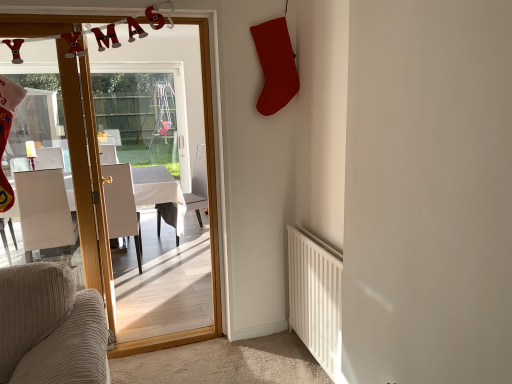
Question: Is white matte radiator at lower right oriented towards white glossy table at center?

Choices:
 (A) yes
 (B) no

Answer: (B)

Question: Is white glossy table at center located within white matte radiator at lower right?

Choices:
 (A) no
 (B) yes

Answer: (A)

Question: Can you confirm if white matte radiator at lower right is bigger than white glossy table at center?

Choices:
 (A) no
 (B) yes

Answer: (A)

Question: From a real-world perspective, is white matte radiator at lower right below white glossy table at center?

Choices:
 (A) no
 (B) yes

Answer: (A)

Question: Is white matte radiator at lower right located outside white glossy table at center?

Choices:
 (A) yes
 (B) no

Answer: (A)

Question: Is white matte radiator at lower right taller than white glossy table at center?

Choices:
 (A) no
 (B) yes

Answer: (B)

Question: Considering the relative positions of white glossy table at center and wooden glass door at center in the image provided, is white glossy table at center behind wooden glass door at center?

Choices:
 (A) yes
 (B) no

Answer: (A)

Question: Is wooden glass door at center completely or partially inside white glossy table at center?

Choices:
 (A) yes
 (B) no

Answer: (B)

Question: Is white glossy table at center oriented away from wooden glass door at center?

Choices:
 (A) yes
 (B) no

Answer: (B)

Question: Is white glossy table at center aimed at wooden glass door at center?

Choices:
 (A) no
 (B) yes

Answer: (A)

Question: Considering the relative sizes of white glossy table at center and wooden glass door at center in the image provided, is white glossy table at center thinner than wooden glass door at center?

Choices:
 (A) yes
 (B) no

Answer: (B)

Question: Is white glossy table at center not within wooden glass door at center?

Choices:
 (A) yes
 (B) no

Answer: (A)

Question: Is white matte radiator at lower right not close to white leather chair at left, the 1th chair when ordered from left to right?

Choices:
 (A) yes
 (B) no

Answer: (A)